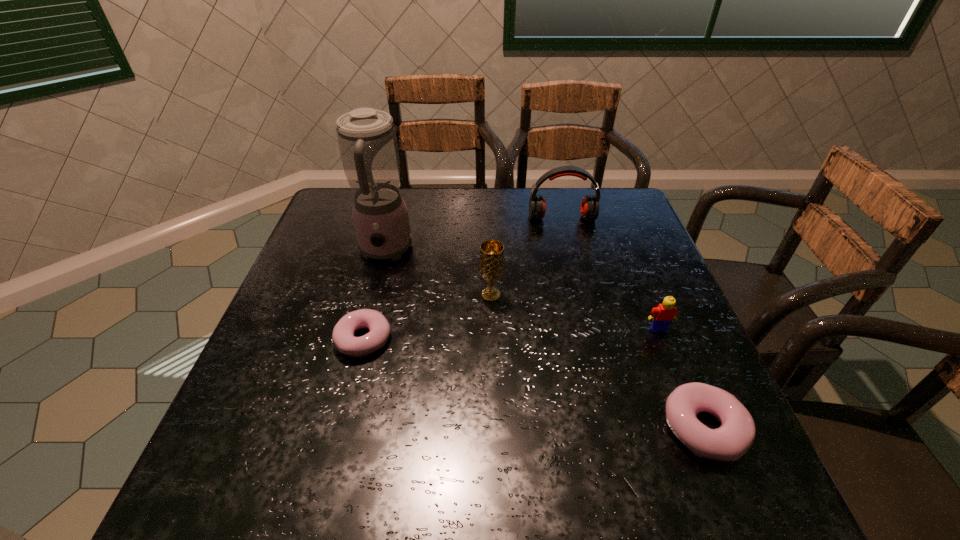
If equal spacing is the goal by inserting an additional doughnut among them, please point out a vacant space for this new doughnut. Please provide its 2D coordinates. Your answer should be formatted as a tuple, i.e. [(x, y)], where the tuple contains the x and y coordinates of a point satisfying the conditions above.

[(518, 380)]